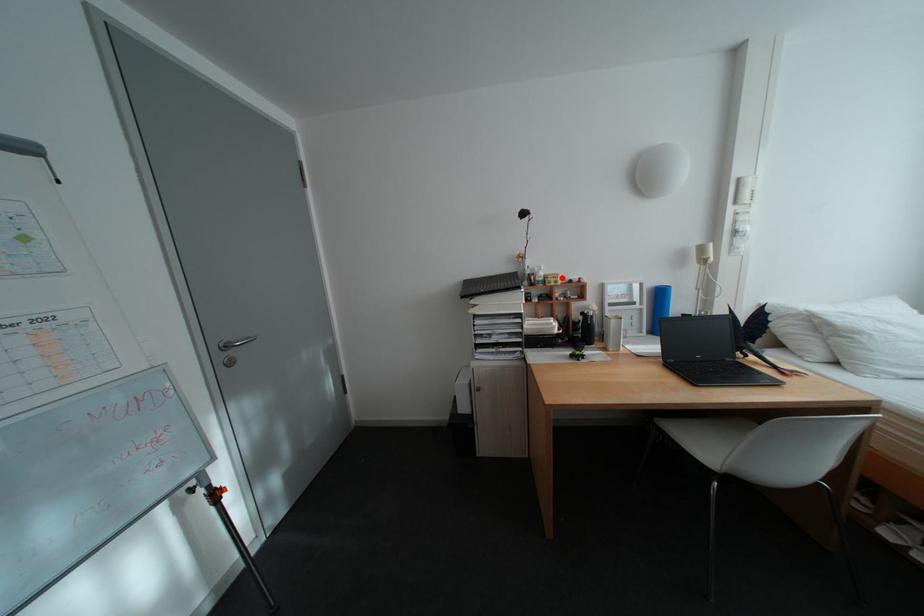
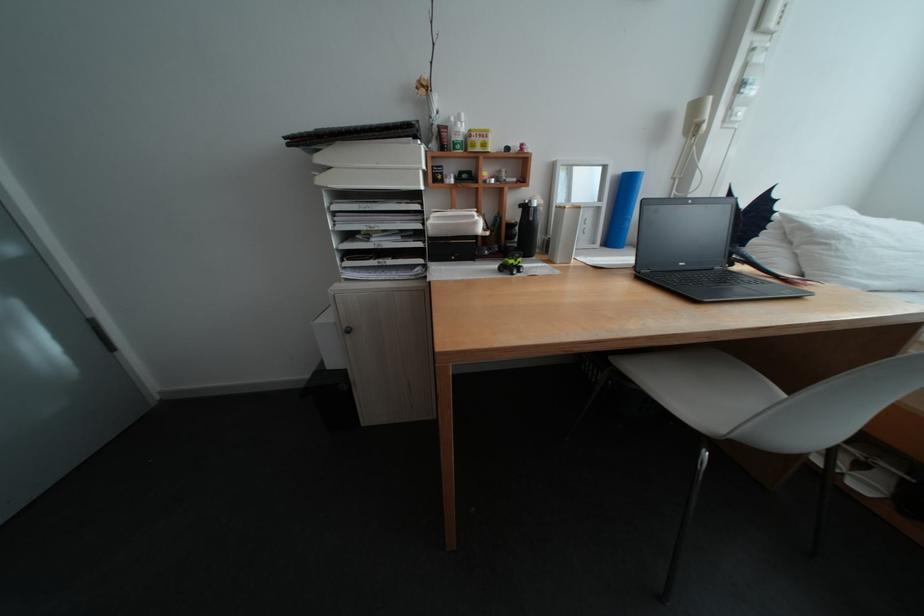
The point at the highlighted location is marked in the first image. Where is the corresponding point in the second image?

(485, 135)